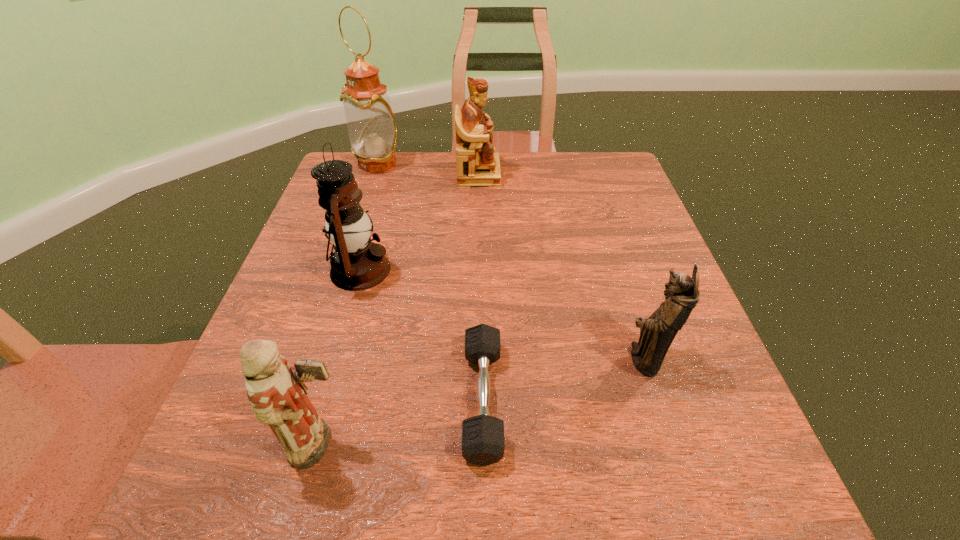
At what (x,y) coordinates should I click in order to perform the action: click on vacant area situated 0.290m on the front-facing side of the nearest figurine. Please return your answer as a coordinate pair (x, y). Image resolution: width=960 pixels, height=540 pixels. Looking at the image, I should click on (546, 445).

In order to click on vacant space located on the front-facing side of the second farthest figurine in this screenshot , I will do `click(570, 359)`.

Locate an element on the screen. vacant region located 0.360m on the front-facing side of the second farthest figurine is located at coordinates (406, 359).

You are a GUI agent. You are given a task and a screenshot of the screen. Output one action in this format:
    pyautogui.click(x=<x>, y=<y>)
    Task: Click on the vacant space situated on the front-facing side of the second farthest figurine
    
    Given the screenshot: What is the action you would take?
    pyautogui.click(x=582, y=359)

The image size is (960, 540). In order to click on vacant space situated 0.090m on the right of the dumbbell in this screenshot , I will do `click(558, 399)`.

Locate an element on the screen. Image resolution: width=960 pixels, height=540 pixels. oil lamp at the far edge is located at coordinates (372, 130).

The width and height of the screenshot is (960, 540). Find the location of `figurine positioned at the far edge`. figurine positioned at the far edge is located at coordinates (478, 165).

The height and width of the screenshot is (540, 960). I want to click on figurine that is positioned at the near edge, so click(276, 391).

The width and height of the screenshot is (960, 540). In order to click on dumbbell that is positioned at the near edge in this screenshot , I will do `click(483, 443)`.

Image resolution: width=960 pixels, height=540 pixels. In order to click on oil lamp located in the left edge section of the desktop in this screenshot , I will do `click(372, 130)`.